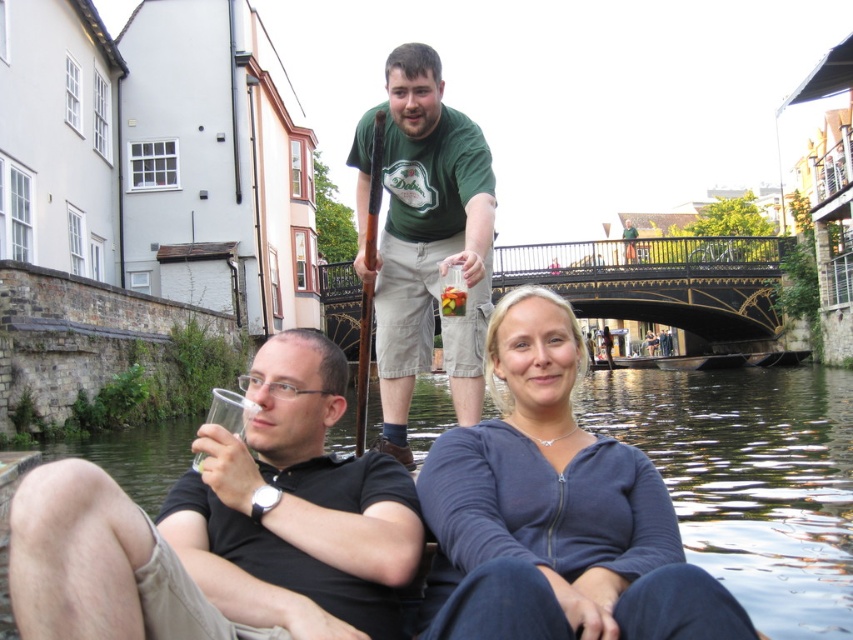
Question: Which is farther from the black matte shirt at lower left?

Choices:
 (A) green cotton shirt at center
 (B) brown wooden paddle at center
 (C) blue zip-up hoodie at center
 (D) transparent plastic water at center

Answer: (D)

Question: Which point is farther to the camera?

Choices:
 (A) green cotton shirt at center
 (B) black matte shirt at lower left
 (C) blue zip-up hoodie at center
 (D) brown wooden paddle at center

Answer: (A)

Question: Does green cotton shirt at center lie behind brown wooden paddle at center?

Choices:
 (A) yes
 (B) no

Answer: (A)

Question: Among these objects, which one is nearest to the camera?

Choices:
 (A) brown wooden paddle at center
 (B) transparent plastic water at center
 (C) green cotton shirt at center
 (D) blue zip-up hoodie at center

Answer: (D)

Question: Considering the relative positions of black matte shirt at lower left and transparent plastic water at center in the image provided, where is black matte shirt at lower left located with respect to transparent plastic water at center?

Choices:
 (A) above
 (B) below

Answer: (A)

Question: In this image, where is black matte shirt at lower left located relative to blue zip-up hoodie at center?

Choices:
 (A) below
 (B) above

Answer: (A)